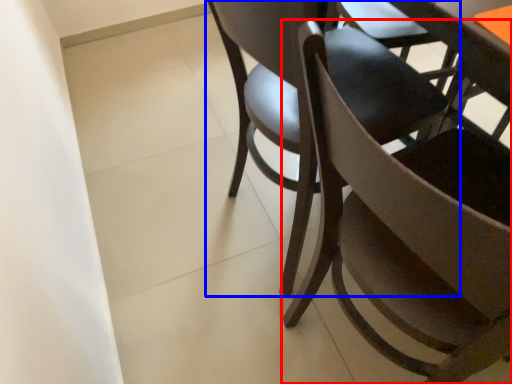
Question: Which point is further to the camera, chair (highlighted by a red box) or chair (highlighted by a blue box)?

Choices:
 (A) chair
 (B) chair

Answer: (B)